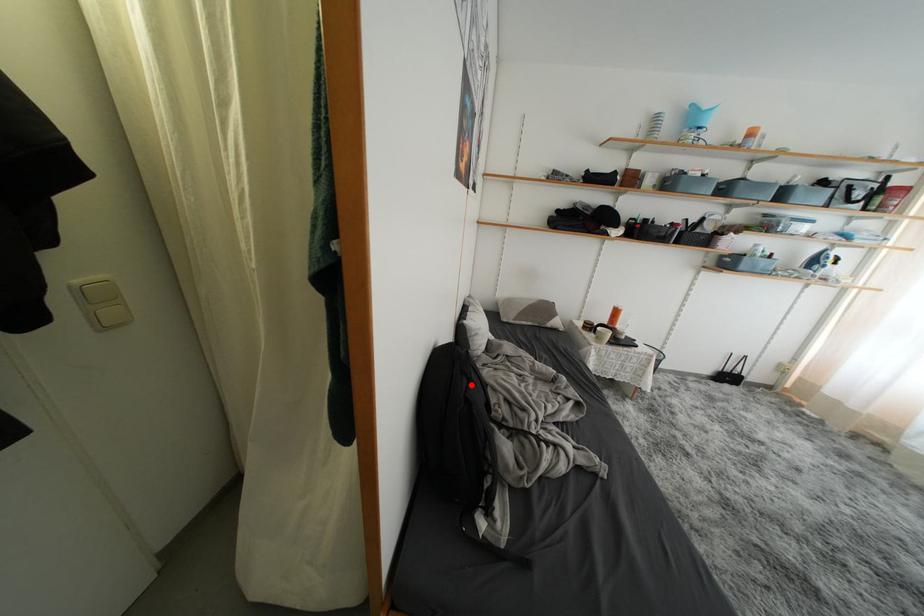
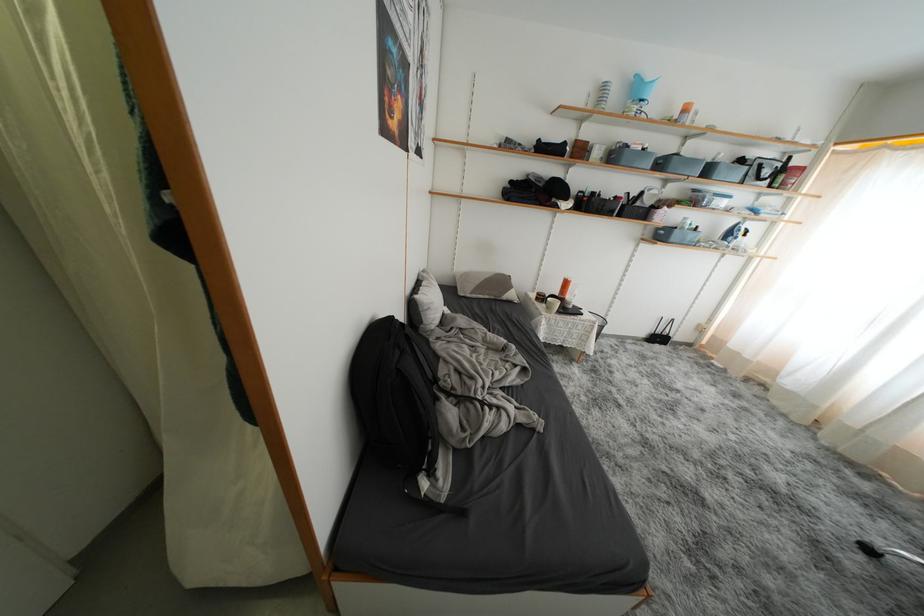
The point at the highlighted location is marked in the first image. Where is the corresponding point in the second image?

(404, 357)